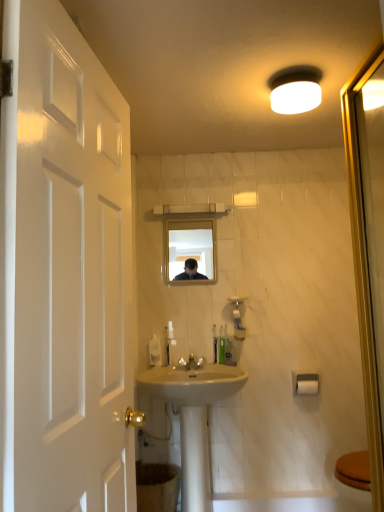
Where is `vacant area that lies in front of translucent plastic soap dispenser at center, the first toiletry viewed from the left`? vacant area that lies in front of translucent plastic soap dispenser at center, the first toiletry viewed from the left is located at coordinates (219, 368).